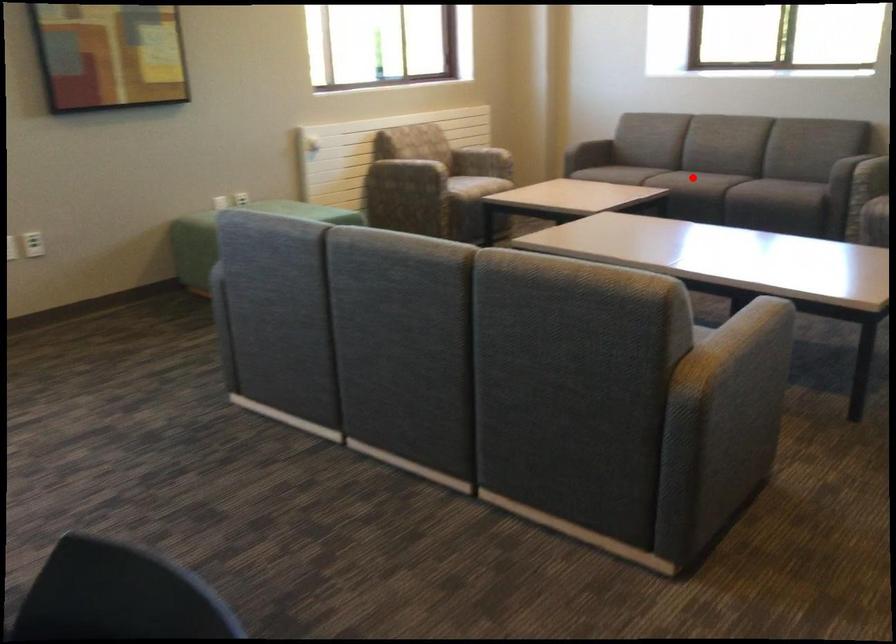
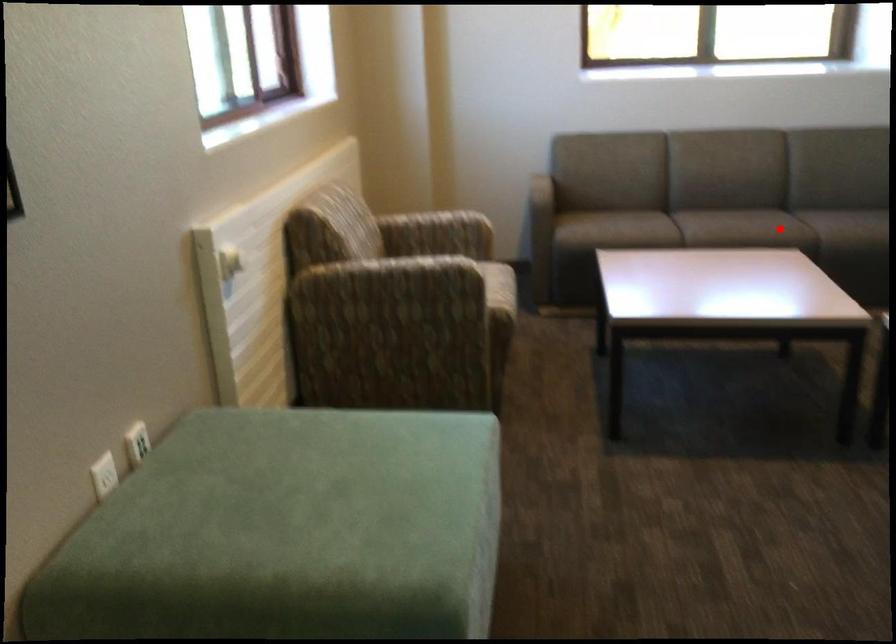
I am providing you with two images of the same scene from different viewpoints. A red point is marked on the first image and another point is marked on the second image. Are the points marked in image1 and image2 representing the same 3D position?

Yes